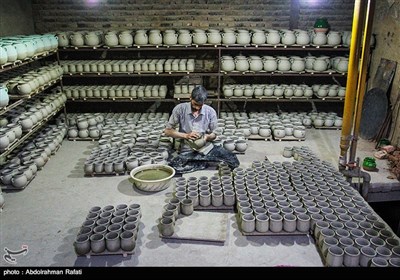
The width and height of the screenshot is (400, 280). In order to click on shelves in this screenshot , I will do `click(209, 72)`, `click(214, 98)`, `click(208, 45)`, `click(23, 62)`, `click(25, 97)`, `click(35, 127)`.